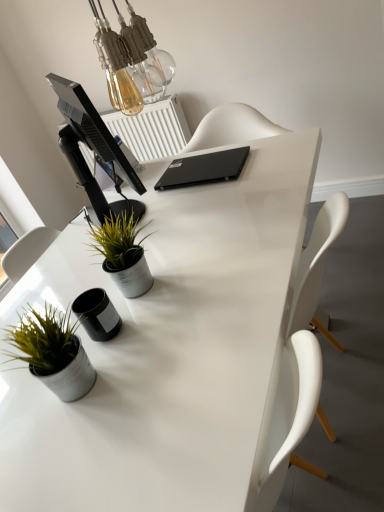
The image size is (384, 512). What are the coordinates of `free spot to the right of metallic gray pot at center, marked as the 1th houseplant in a back-to-front arrangement` in the screenshot? It's located at (193, 257).